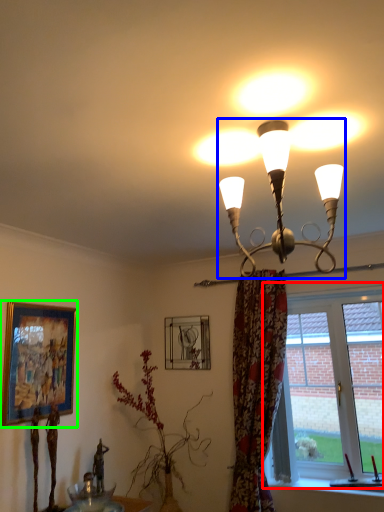
Question: Based on their relative distances, which object is farther from window (highlighted by a red box)? Choose from lamp (highlighted by a blue box) and picture frame (highlighted by a green box).

Choices:
 (A) lamp
 (B) picture frame

Answer: (B)